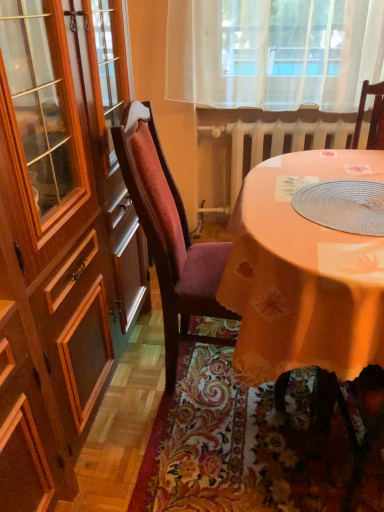
Find the location of `free space that is to the left of clear plastic placemat at center`. free space that is to the left of clear plastic placemat at center is located at coordinates (270, 208).